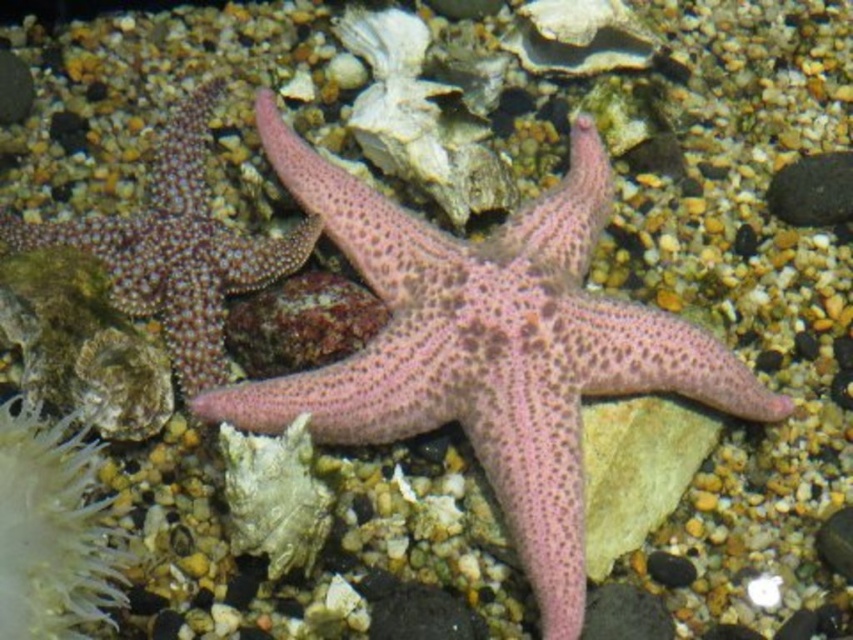
I want to click on pink spiny starfish at center, so pyautogui.click(x=489, y=348).

Between pink spiny starfish at center and spongy pink starfish at center, which one has more height?

pink spiny starfish at center

Can you confirm if pink spiny starfish at center is wider than spongy pink starfish at center?

Yes.

Does point (563, 403) lie in front of point (241, 448)?

No, (563, 403) is behind (241, 448).

Find the location of a particular element. pink spiny starfish at center is located at coordinates (489, 348).

Between point (42, 442) and point (801, 157), which one is positioned behind?

Positioned behind is point (801, 157).

I want to click on translucent gelatinous at lower left, so click(51, 531).

Find the location of a particular element. translucent gelatinous at lower left is located at coordinates (51, 531).